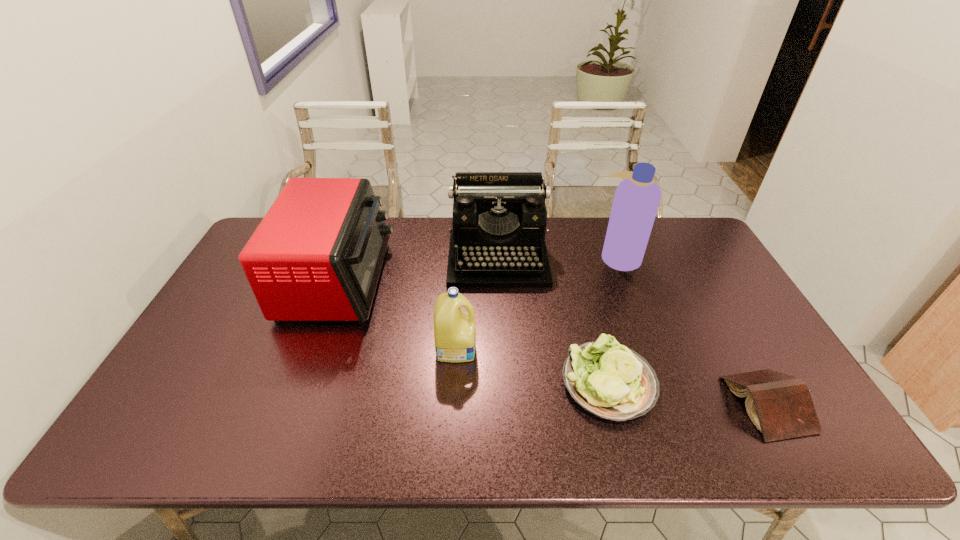
The width and height of the screenshot is (960, 540). In order to click on vacant region at the far edge of the desktop in this screenshot , I will do `click(644, 256)`.

The image size is (960, 540). In the image, there is a desktop. Identify the location of blank space at the near edge. [348, 447].

Identify the location of free space at the far right corner of the desktop. (663, 244).

Identify the location of empty space between the leftmost object and the typewriter. Image resolution: width=960 pixels, height=540 pixels. (419, 269).

I want to click on free space between the tallest object and the rightmost object, so click(693, 330).

Locate an element on the screen. This screenshot has width=960, height=540. free space that is in between the shampoo and the typewriter is located at coordinates (559, 258).

What are the coordinates of `vacant area that lies between the leftmost object and the typewriter` in the screenshot? It's located at (419, 269).

I want to click on free point between the lettuce and the typewriter, so click(553, 321).

Locate an element on the screen. The width and height of the screenshot is (960, 540). free spot between the typewriter and the rightmost object is located at coordinates (633, 332).

Identify the location of unoccupied position between the shortest object and the tallest object. (693, 330).